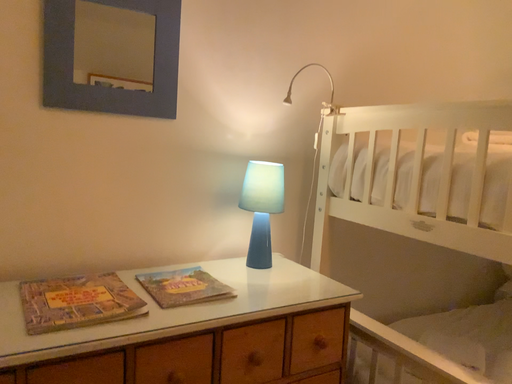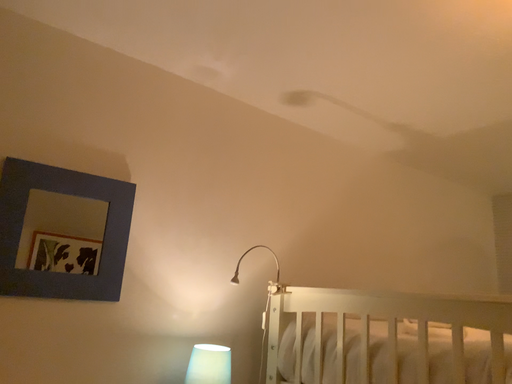
Question: How did the camera likely rotate when shooting the video?

Choices:
 (A) rotated downward
 (B) rotated upward

Answer: (B)